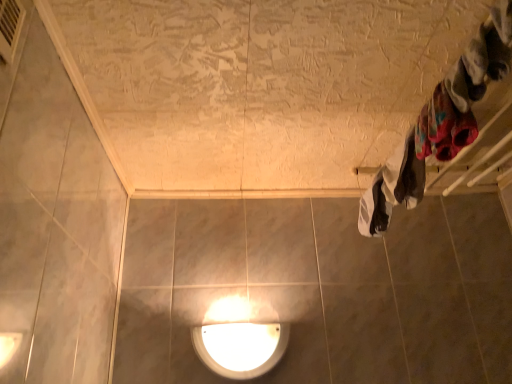
Question: Should I look upward or downward to see white glossy lamp at lower center?

Choices:
 (A) up
 (B) down

Answer: (B)

Question: Can you confirm if metallic silver air conditioner at upper left is smaller than white glossy lamp at lower center?

Choices:
 (A) yes
 (B) no

Answer: (A)

Question: Is metallic silver air conditioner at upper left oriented away from white glossy lamp at lower center?

Choices:
 (A) no
 (B) yes

Answer: (A)

Question: From a real-world perspective, is metallic silver air conditioner at upper left physically below white glossy lamp at lower center?

Choices:
 (A) no
 (B) yes

Answer: (A)

Question: Considering the relative sizes of metallic silver air conditioner at upper left and white glossy lamp at lower center in the image provided, is metallic silver air conditioner at upper left taller than white glossy lamp at lower center?

Choices:
 (A) no
 (B) yes

Answer: (A)

Question: Could you tell me if metallic silver air conditioner at upper left is turned towards white glossy lamp at lower center?

Choices:
 (A) no
 (B) yes

Answer: (A)

Question: Can you confirm if metallic silver air conditioner at upper left is positioned to the right of white glossy lamp at lower center?

Choices:
 (A) no
 (B) yes

Answer: (A)

Question: Is white cotton towel at right, marked as the first clothing in a back-to-front arrangement, to the left of fluffy white socks at upper right, which is the 3th clothing from back to front, from the viewer's perspective?

Choices:
 (A) no
 (B) yes

Answer: (A)

Question: Are white cotton towel at right, placed as the 3th clothing when sorted from top to bottom, and fluffy white socks at upper right, which is the 3th clothing in bottom-to-top order, far apart?

Choices:
 (A) yes
 (B) no

Answer: (B)

Question: From the image's perspective, does white cotton towel at right, placed as the 1th clothing when sorted from bottom to top, appear higher than fluffy white socks at upper right, which is the 3th clothing from back to front?

Choices:
 (A) yes
 (B) no

Answer: (B)

Question: From a real-world perspective, is white cotton towel at right, marked as the first clothing in a back-to-front arrangement, over fluffy white socks at upper right, which is the 3th clothing from back to front?

Choices:
 (A) no
 (B) yes

Answer: (A)

Question: Is fluffy white socks at upper right, which is the 3th clothing in bottom-to-top order, inside white cotton towel at right, marked as the first clothing in a back-to-front arrangement?

Choices:
 (A) no
 (B) yes

Answer: (A)

Question: Considering the relative sizes of white cotton towel at right, marked as the third clothing in a front-to-back arrangement, and fluffy white socks at upper right, which is the 3th clothing from back to front, in the image provided, is white cotton towel at right, marked as the third clothing in a front-to-back arrangement, smaller than fluffy white socks at upper right, which is the 3th clothing from back to front,?

Choices:
 (A) yes
 (B) no

Answer: (B)

Question: Does white cotton towel at right, placed as the 1th clothing when sorted from bottom to top, have a lesser width compared to white glossy lamp at lower center?

Choices:
 (A) no
 (B) yes

Answer: (A)